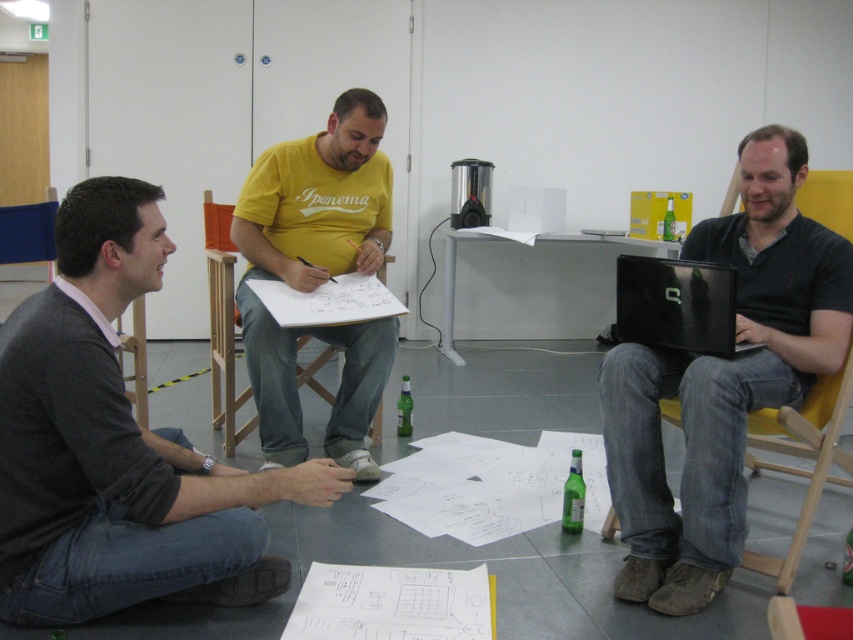
You are organizing a presentation and need to place both the matte black laptop at right and the white plastic table at center on a narrow shelf. Which object should you place first to ensure they both fit?

The matte black laptop at right is thinner than the white plastic table at center, so you should place the white plastic table at center first to ensure both fit on the narrow shelf.

You are organizing a small presentation and need to set up a projector. The projector requires a minimum distance of 6 feet between the matte black laptop at right and the white plastic table at center to function properly. Based on the scene description, will the current setup allow the projector to work?

The matte black laptop at right is 6.49 feet from the white plastic table at center, which exceeds the required 6 feet distance. Therefore, the projector should function properly with the current setup.